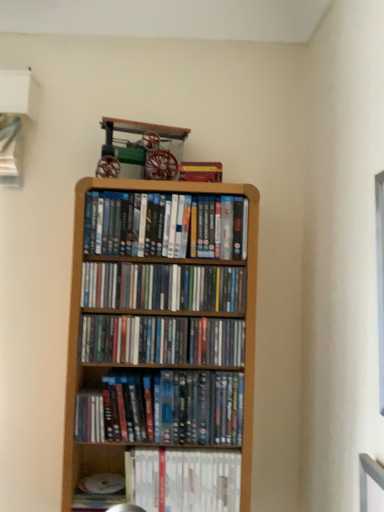
Question: From a real-world perspective, relative to matte plastic dvds at center, acting as the third book starting from the top, is matte plastic dvds at center, which is counted as the 5th book, starting from the bottom, vertically above or below?

Choices:
 (A) below
 (B) above

Answer: (B)

Question: In the image, is matte plastic dvds at center, which is counted as the 5th book, starting from the bottom, on the left side or the right side of matte plastic dvds at center, acting as the third book starting from the top?

Choices:
 (A) left
 (B) right

Answer: (B)

Question: Based on their relative distances, which object is nearer to the white glossy book at lower center, the 5th book positioned from the top?

Choices:
 (A) matte plastic books at center, which is the 4th book in top-to-bottom order
 (B) matte plastic dvds at center, which is counted as the 5th book, starting from the bottom
 (C) matte plastic dvds at center, acting as the third book starting from the top
 (D) wooden shelf at center, the 4th book positioned from the bottom
 (E) wooden bookcase at center

Answer: (A)

Question: Considering the real-world distances, which object is closest to the matte plastic dvds at center, which is the third book from bottom to top?

Choices:
 (A) wooden shelf at center, the 4th book positioned from the bottom
 (B) matte plastic dvds at center, which is counted as the 5th book, starting from the bottom
 (C) wooden bookcase at center
 (D) white glossy book at lower center, the 5th book positioned from the top
 (E) matte plastic books at center, which is the 4th book in top-to-bottom order

Answer: (A)